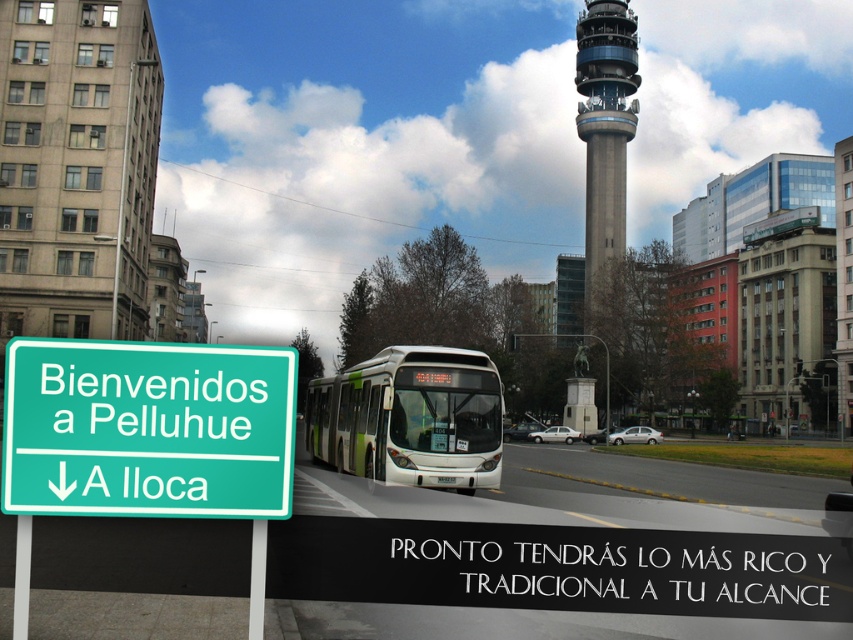
Question: Is the position of green matte bus at center more distant than that of concrete tower at upper center?

Choices:
 (A) no
 (B) yes

Answer: (A)

Question: Which object is the closest to the green matte bus at center?

Choices:
 (A) green plastic sign at lower left
 (B) concrete tower at upper center

Answer: (A)

Question: Considering the relative positions of green matte bus at center and concrete tower at upper center in the image provided, where is green matte bus at center located with respect to concrete tower at upper center?

Choices:
 (A) left
 (B) right

Answer: (A)

Question: Which object is the closest to the green matte bus at center?

Choices:
 (A) concrete tower at upper center
 (B) green plastic sign at lower left

Answer: (B)

Question: Does green matte bus at center have a greater width compared to concrete tower at upper center?

Choices:
 (A) yes
 (B) no

Answer: (B)

Question: Which object is positioned closest to the green plastic sign at lower left?

Choices:
 (A) concrete tower at upper center
 (B) green matte bus at center

Answer: (B)